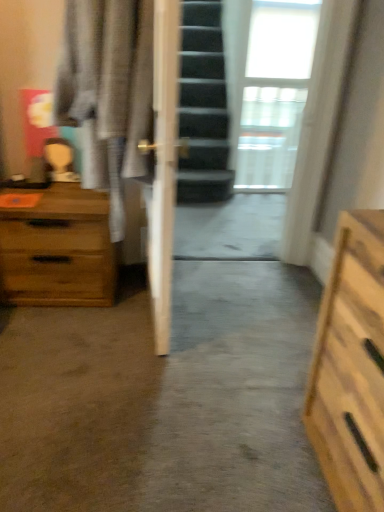
Question: Is white sheer curtain at upper right further to camera compared to transparent glass door at center?

Choices:
 (A) yes
 (B) no

Answer: (A)

Question: From a real-world perspective, is white sheer curtain at upper right beneath transparent glass door at center?

Choices:
 (A) no
 (B) yes

Answer: (B)

Question: Considering the relative positions of white sheer curtain at upper right and transparent glass door at center in the image provided, is white sheer curtain at upper right to the left of transparent glass door at center from the viewer's perspective?

Choices:
 (A) no
 (B) yes

Answer: (A)

Question: Does white sheer curtain at upper right have a lesser height compared to transparent glass door at center?

Choices:
 (A) no
 (B) yes

Answer: (A)

Question: Is white sheer curtain at upper right far away from transparent glass door at center?

Choices:
 (A) yes
 (B) no

Answer: (B)

Question: Is white sheer curtain at upper right aimed at transparent glass door at center?

Choices:
 (A) yes
 (B) no

Answer: (B)

Question: Does wooden chest of drawers at left have a lesser height compared to light gray fabric robe at left?

Choices:
 (A) no
 (B) yes

Answer: (B)

Question: Can you see wooden chest of drawers at left touching light gray fabric robe at left?

Choices:
 (A) no
 (B) yes

Answer: (A)

Question: From the image's perspective, is wooden chest of drawers at left below light gray fabric robe at left?

Choices:
 (A) yes
 (B) no

Answer: (A)

Question: Is wooden chest of drawers at left surrounding light gray fabric robe at left?

Choices:
 (A) no
 (B) yes

Answer: (A)

Question: Is wooden chest of drawers at left located outside light gray fabric robe at left?

Choices:
 (A) no
 (B) yes

Answer: (B)

Question: Considering the relative sizes of wooden chest of drawers at left and light gray fabric robe at left in the image provided, is wooden chest of drawers at left thinner than light gray fabric robe at left?

Choices:
 (A) no
 (B) yes

Answer: (A)

Question: Is wooden chest of drawers at left behind transparent glass door at center?

Choices:
 (A) no
 (B) yes

Answer: (A)